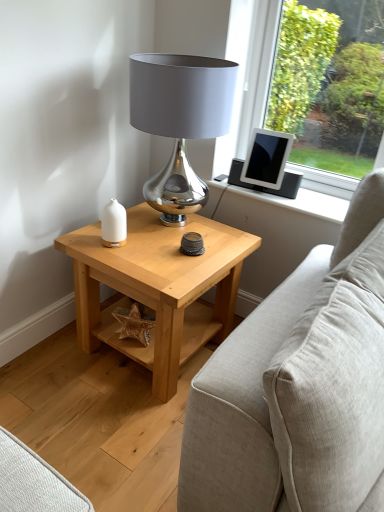
Where is `vacant region in front of white matte candle holder at left`? vacant region in front of white matte candle holder at left is located at coordinates (115, 260).